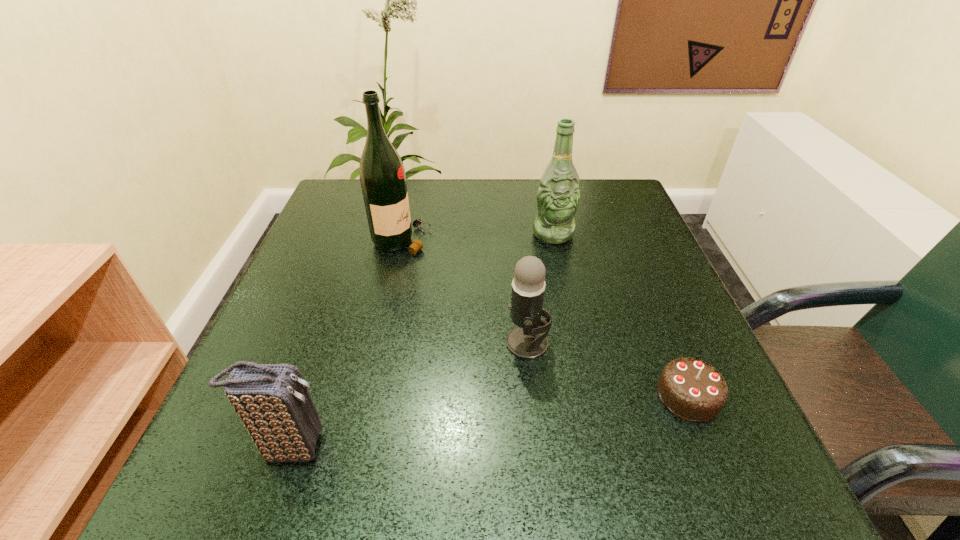
Where is `free space located on the left of the microphone`? Image resolution: width=960 pixels, height=540 pixels. free space located on the left of the microphone is located at coordinates (350, 343).

Where is `free location located with the zip open on the clutch bag`? This screenshot has width=960, height=540. free location located with the zip open on the clutch bag is located at coordinates (400, 447).

Where is `vacant space situated 0.280m on the left of the shortest object`? vacant space situated 0.280m on the left of the shortest object is located at coordinates (x=477, y=396).

Image resolution: width=960 pixels, height=540 pixels. Identify the location of wine bottle that is positioned at the far edge. (382, 175).

What are the coordinates of `beer bottle situated at the far edge` in the screenshot? It's located at (558, 196).

Where is `object situated at the near edge`? object situated at the near edge is located at coordinates (273, 402).

I want to click on wine bottle located in the left edge section of the desktop, so click(382, 175).

Locate an element on the screen. The width and height of the screenshot is (960, 540). clutch bag present at the left edge is located at coordinates (273, 402).

What are the coordinates of `object situated at the right edge` in the screenshot? It's located at (692, 389).

Find the location of a particular element. This screenshot has width=960, height=540. object at the far left corner is located at coordinates (382, 175).